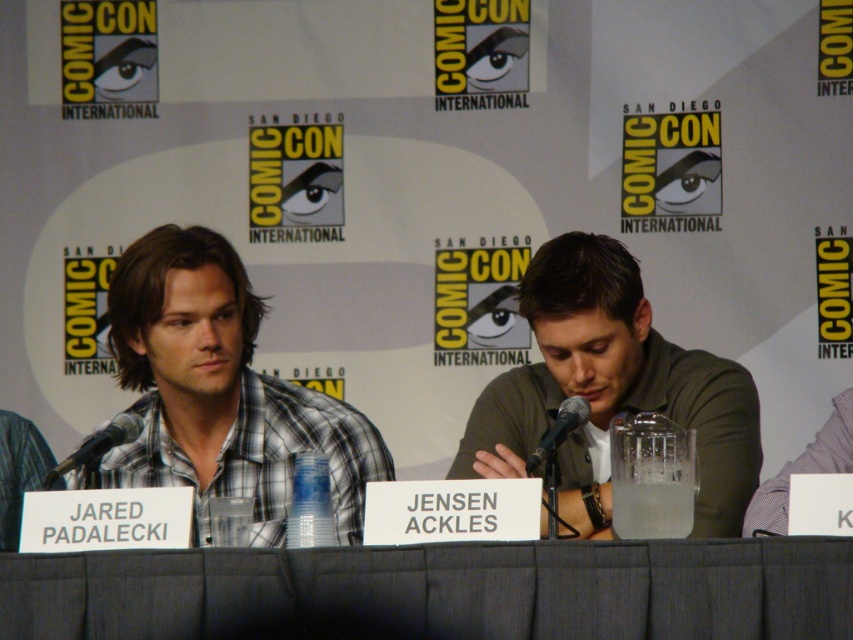
Is point (599, 365) less distant than point (569, 424)?

No, (599, 365) is further to viewer.

Is green matte shirt at center closer to the viewer compared to black metallic microphone at center?

No, it is behind black metallic microphone at center.

Where is `green matte shirt at center`? green matte shirt at center is located at coordinates (611, 388).

Is plaid shirt at left in front of black metallic microphone at left?

Yes, it is in front of black metallic microphone at left.

Does plaid shirt at left have a larger size compared to black metallic microphone at left?

Yes.

Describe the element at coordinates (219, 394) in the screenshot. The image size is (853, 640). I see `plaid shirt at left` at that location.

Locate an element on the screen. This screenshot has height=640, width=853. plaid shirt at left is located at coordinates (219, 394).

Can you confirm if plaid shirt at left is thinner than green matte shirt at center?

Incorrect, plaid shirt at left's width is not less than green matte shirt at center's.

This screenshot has height=640, width=853. What do you see at coordinates (219, 394) in the screenshot?
I see `plaid shirt at left` at bounding box center [219, 394].

Find the location of a particular element. The height and width of the screenshot is (640, 853). plaid shirt at left is located at coordinates pyautogui.click(x=219, y=394).